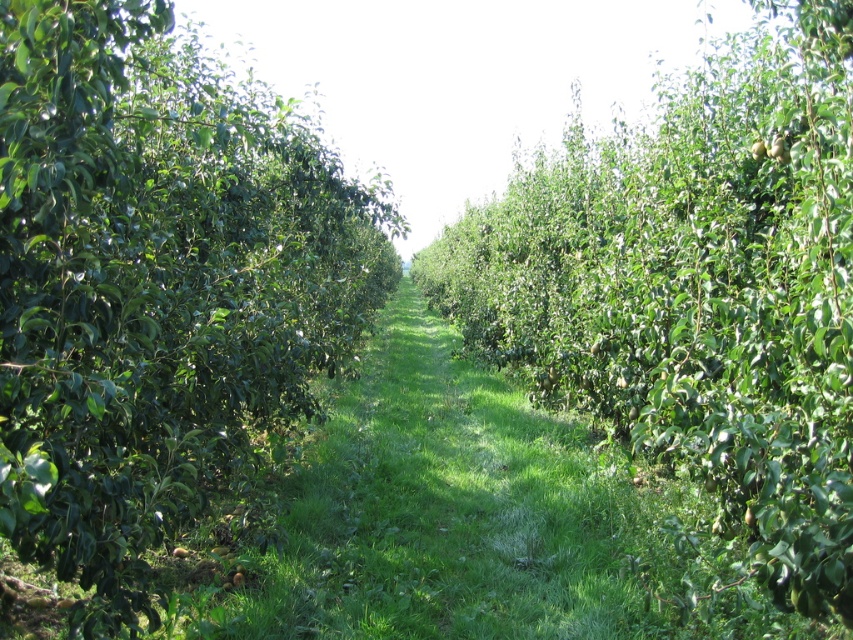
In the scene shown: Is green glossy tree at left wider than green grass at center?

No.

Consider the image. Who is taller, green glossy tree at left or green grass at center?

green grass at center

Where is `green glossy tree at left`? green glossy tree at left is located at coordinates (154, 285).

Is green leafy tree at center to the left of green grass at center from the viewer's perspective?

No, green leafy tree at center is not to the left of green grass at center.

Is point (842, 236) positioned in front of point (412, 609)?

Yes, it is.

Find the location of `green leafy tree at center`. green leafy tree at center is located at coordinates (695, 291).

Is green glossy tree at left positioned at the back of green leafy tree at center?

Yes, green glossy tree at left is behind green leafy tree at center.

Where is `green glossy tree at left`? Image resolution: width=853 pixels, height=640 pixels. green glossy tree at left is located at coordinates (154, 285).